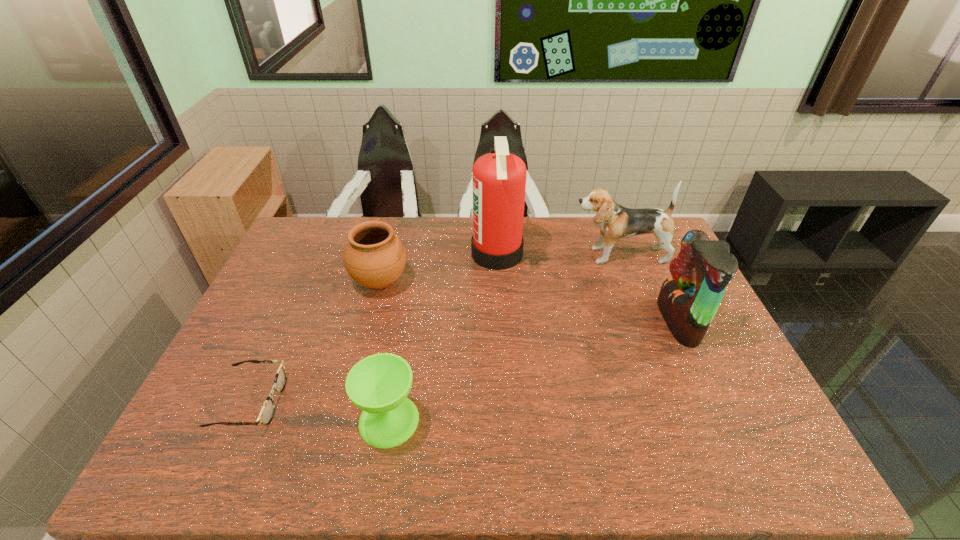
At what (x,y) coordinates should I click in order to perform the action: click on vacant space located 0.250m at the nozzle of the third object from right to left. Please return your answer as a coordinate pair (x, y). The width and height of the screenshot is (960, 540). Looking at the image, I should click on (399, 254).

Find the location of `vacant space situated at the face of the puppy`. vacant space situated at the face of the puppy is located at coordinates (471, 256).

Locate an element on the screen. The height and width of the screenshot is (540, 960). vacant region located at the face of the puppy is located at coordinates (541, 256).

Identify the location of vacant space located 0.060m at the face of the puppy. The width and height of the screenshot is (960, 540). (553, 256).

At what (x,y) coordinates should I click in order to perform the action: click on vacant space located at the face of the parrot. Please return your answer as a coordinate pair (x, y). The width and height of the screenshot is (960, 540). Looking at the image, I should click on (569, 321).

Where is `blank area located at the face of the parrot`? blank area located at the face of the parrot is located at coordinates (580, 321).

The image size is (960, 540). What are the coordinates of `blank space located 0.080m at the face of the parrot` in the screenshot? It's located at (635, 321).

At what (x,y) coordinates should I click in order to perform the action: click on vacant space located on the left of the pottery. Please return your answer as a coordinate pair (x, y). Looking at the image, I should click on (310, 282).

What are the coordinates of `vacant space situated on the back of the fifth tallest object` in the screenshot? It's located at (408, 312).

The image size is (960, 540). Identify the location of blank space located 0.240m on the frame of the leftmost object. (377, 402).